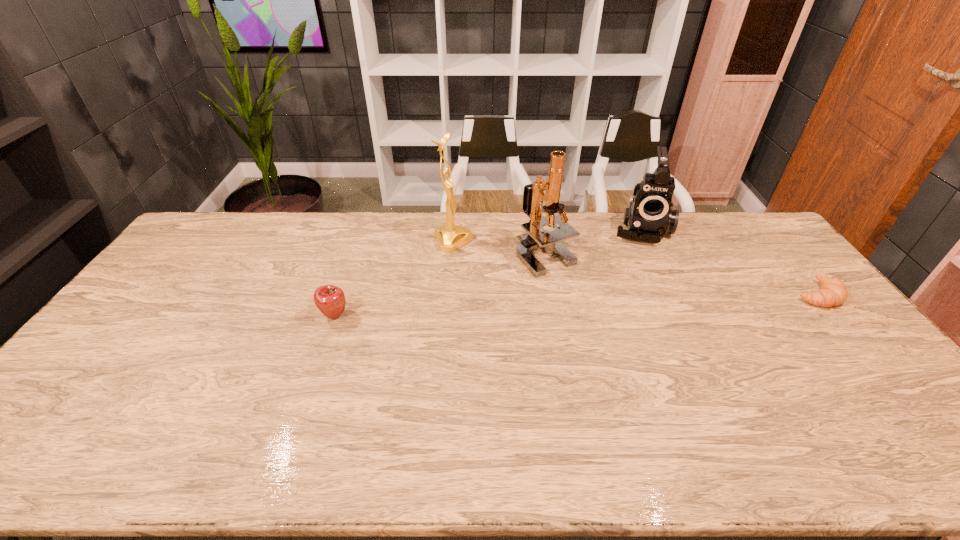
This screenshot has width=960, height=540. I want to click on award present at the far edge, so click(x=450, y=237).

You are a GUI agent. You are given a task and a screenshot of the screen. Output one action in this format:
    pyautogui.click(x=<x>, y=<y>)
    Task: Click on the camcorder present at the far edge
    The image size is (960, 540).
    Given the screenshot: What is the action you would take?
    pyautogui.click(x=649, y=217)

Where is `object that is at the right edge`? This screenshot has height=540, width=960. object that is at the right edge is located at coordinates (833, 292).

In the image, there is a desktop. Identify the location of vacant space at the far edge. The width and height of the screenshot is (960, 540). (356, 243).

Where is `vacant area at the near edge of the desktop`? This screenshot has width=960, height=540. vacant area at the near edge of the desktop is located at coordinates (237, 412).

Image resolution: width=960 pixels, height=540 pixels. What are the coordinates of `free region at the left edge of the desktop` in the screenshot? It's located at (152, 326).

The image size is (960, 540). In the image, there is a desktop. What are the coordinates of `vacant space at the right edge` in the screenshot? It's located at (750, 255).

Identify the location of vacant space that is in between the award and the crescent roll. (635, 268).

This screenshot has width=960, height=540. Identify the location of empty location between the fourth tallest object and the third shortest object. (488, 272).

Where is `free spot between the apple and the award`? The image size is (960, 540). free spot between the apple and the award is located at coordinates (394, 279).